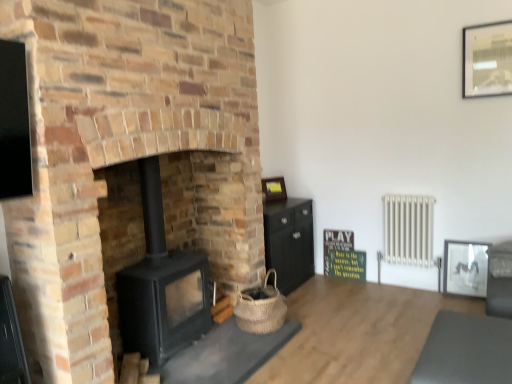
Locate an element on the screen. The height and width of the screenshot is (384, 512). vacant space situated above smooth gray mat at lower right (from a real-world perspective) is located at coordinates click(480, 346).